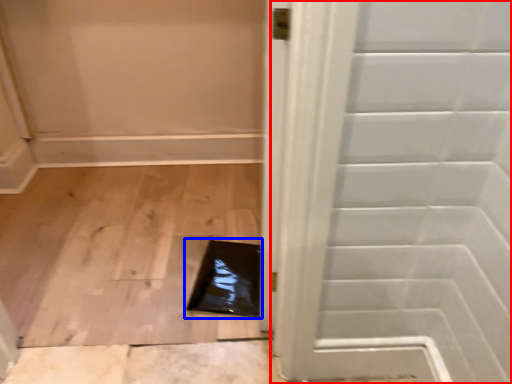
Question: Which point is further to the camera, door (highlighted by a red box) or hole (highlighted by a blue box)?

Choices:
 (A) door
 (B) hole

Answer: (B)